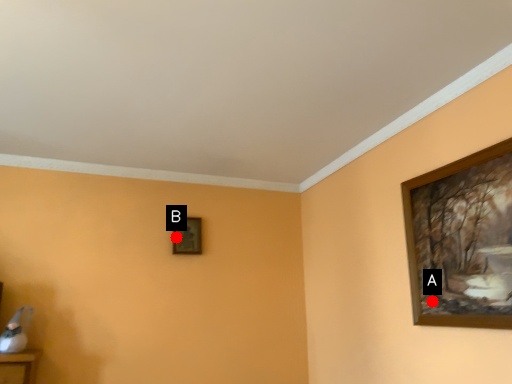
Question: Two points are circled on the image, labeled by A and B beside each circle. Which point is farther to the camera?

Choices:
 (A) A is further
 (B) B is further

Answer: (B)